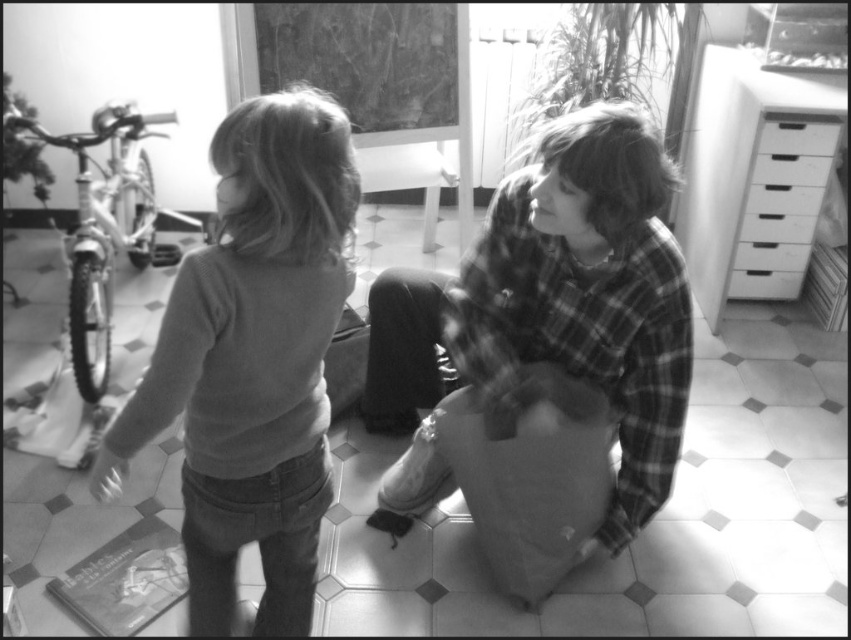
Question: Considering the real-world distances, which object is farthest from the white plastic drawer at upper right?

Choices:
 (A) smooth gray sweater at center
 (B) white plastic drawers at right

Answer: (A)

Question: Can you confirm if white plastic drawers at right is thinner than white plastic drawer at upper right?

Choices:
 (A) yes
 (B) no

Answer: (B)

Question: Does white plastic dresser at upper right have a lesser width compared to white plastic drawers at right?

Choices:
 (A) no
 (B) yes

Answer: (A)

Question: Based on their relative distances, which object is farther from the smooth gray sweater at center?

Choices:
 (A) flannel shirt at center
 (B) white plastic drawers at right
 (C) white plastic dresser at upper right
 (D) white plastic drawer at upper right

Answer: (C)

Question: Does smooth gray sweater at center appear on the right side of flannel shirt at center?

Choices:
 (A) no
 (B) yes

Answer: (A)

Question: Among these objects, which one is farthest from the camera?

Choices:
 (A) white plastic drawers at right
 (B) white plastic dresser at upper right
 (C) white plastic drawer at upper right

Answer: (C)